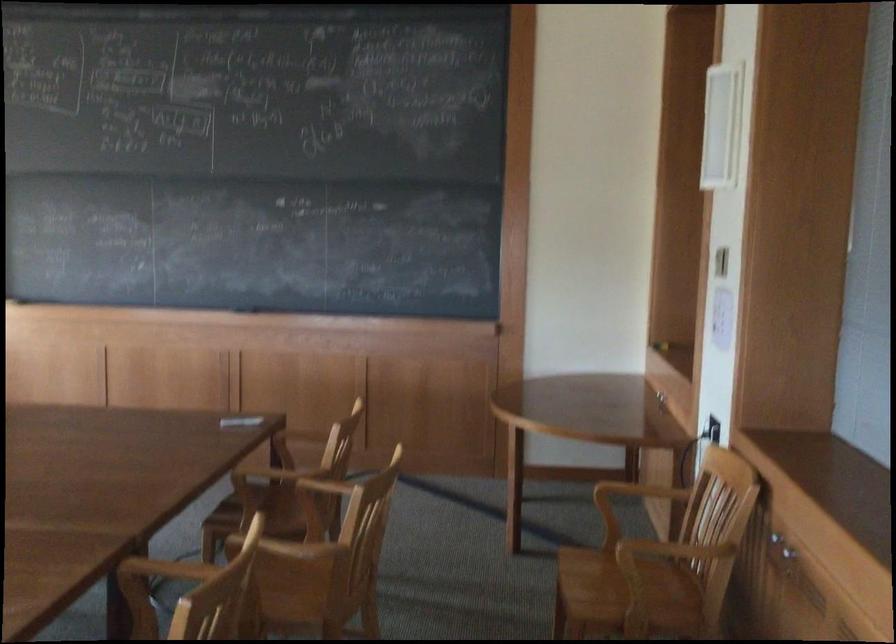
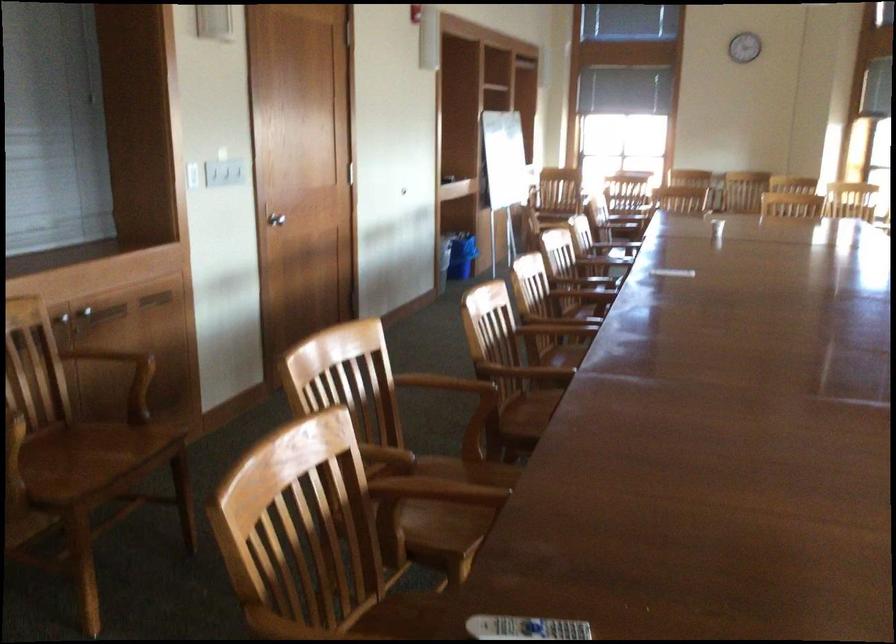
Question: I am providing you with two images of the same scene from different viewpoints. After the viewpoint changes to image2, which objects are now occluded?

Choices:
 (A) wooden chair armrest
 (B) purple cap container
 (C) white light switch
 (D) blue trash can

Answer: (A)